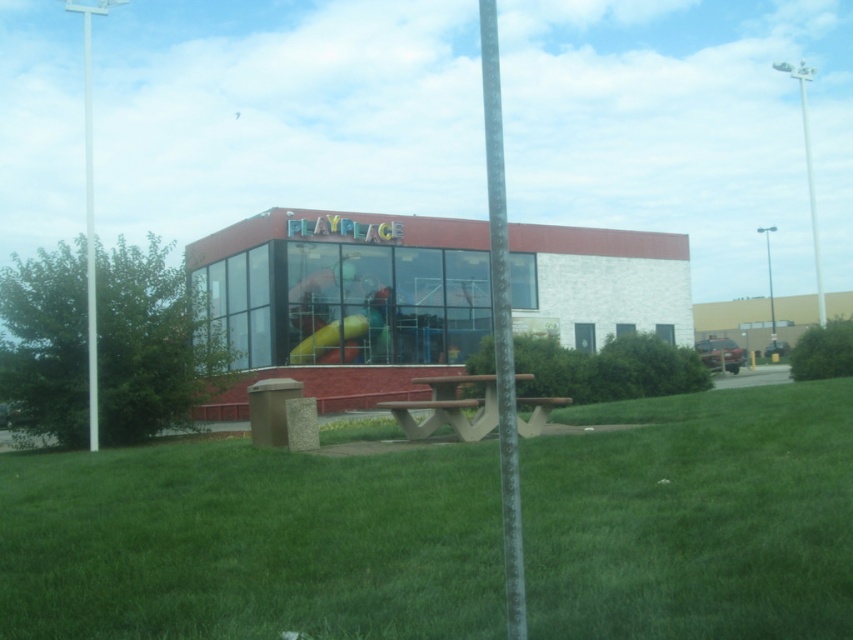
You are planning to install a new bench between the brown concrete picnic table at center and the white metallic pole at upper right. If the bench requires 2 meters of space to be placed comfortably, can it be placed between them?

The distance between the brown concrete picnic table at center and the white metallic pole at upper right is 31.11 meters. Since the bench requires 2 meters of space, there is sufficient space to place it between them.

You are planning to place a new bench exactly between the brown wood picnic table at center and the yellow rubber slide at center. Based on their positions, which side of the slide will the bench be closer to?

The bench will be closer to the yellow rubber slide at center because the brown wood picnic table at center is positioned to the right of the slide, so the midpoint between them would be nearer to the slide.

From the picture: You are planning to host a small gathering and need to choose between the brown concrete picnic table at center and the brown wood picnic table at center. Based on their size, which one can accommodate more guests?

The brown wood picnic table at center can accommodate more guests because it occupies more space than the brown concrete picnic table at center.